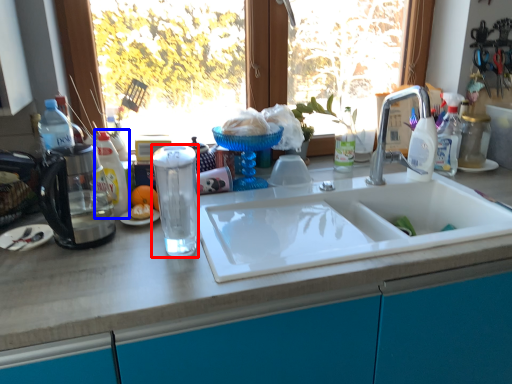
Question: Among these objects, which one is nearest to the camera, beverage (highlighted by a red box) or bottle (highlighted by a blue box)?

Choices:
 (A) beverage
 (B) bottle

Answer: (A)